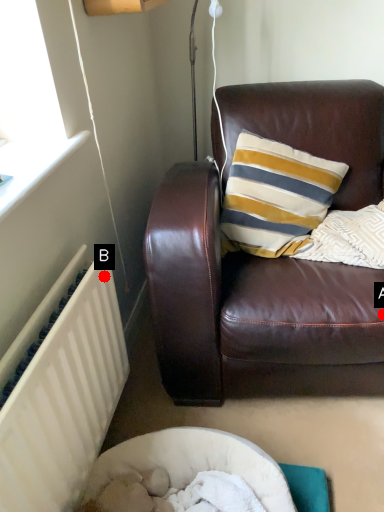
Question: Two points are circled on the image, labeled by A and B beside each circle. Which of the following is the closest to the observer?

Choices:
 (A) A is closer
 (B) B is closer

Answer: (B)